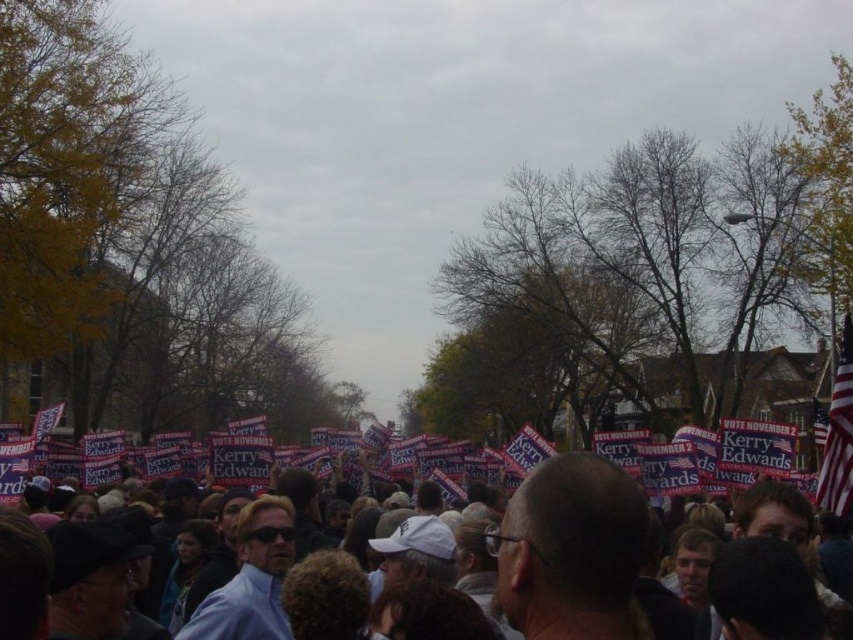
Question: Can you confirm if red plastic signs at center is positioned below american flag at right?

Choices:
 (A) no
 (B) yes

Answer: (B)

Question: Does red plastic signs at center appear on the right side of american flag at right?

Choices:
 (A) yes
 (B) no

Answer: (B)

Question: Where is red plastic signs at center located in relation to american flag at right in the image?

Choices:
 (A) right
 (B) left

Answer: (B)

Question: Which point is closer to the camera?

Choices:
 (A) red plastic signs at center
 (B) american flag at right

Answer: (A)

Question: Among these objects, which one is nearest to the camera?

Choices:
 (A) red plastic signs at center
 (B) american flag at right

Answer: (A)

Question: Which point is farther to the camera?

Choices:
 (A) american flag at right
 (B) red plastic signs at center

Answer: (A)